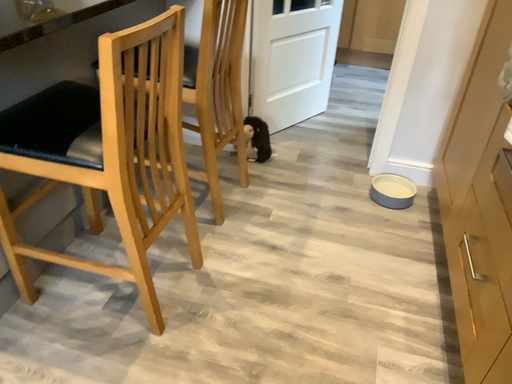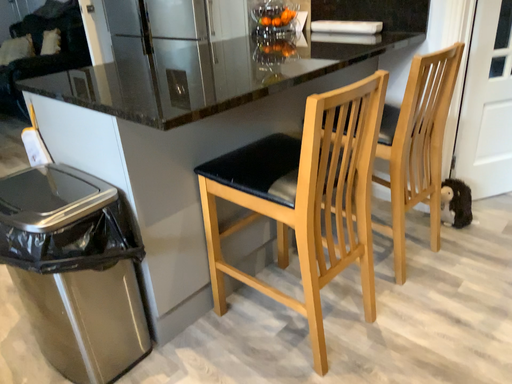
Question: How did the camera likely rotate when shooting the video?

Choices:
 (A) rotated downward
 (B) rotated upward

Answer: (B)